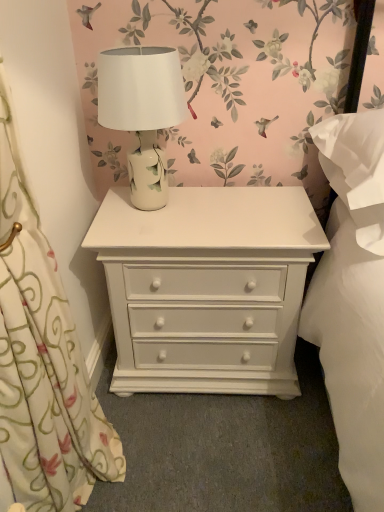
At what (x,y) coordinates should I click in order to perform the action: click on vacant region under white ceramic table lamp at center (from a real-world perspective). Please return your answer as a coordinate pair (x, y). This screenshot has height=512, width=384. Looking at the image, I should click on (163, 207).